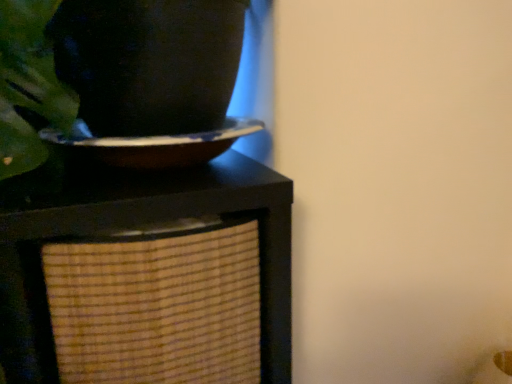
Measure the distance between point (134, 284) and camera.

23.78 inches.

Find the location of a particular element. This screenshot has height=384, width=512. brown woven basket at center is located at coordinates (147, 276).

Describe the element at coordinates (147, 276) in the screenshot. I see `brown woven basket at center` at that location.

Locate an element on the screen. brown woven basket at center is located at coordinates (147, 276).